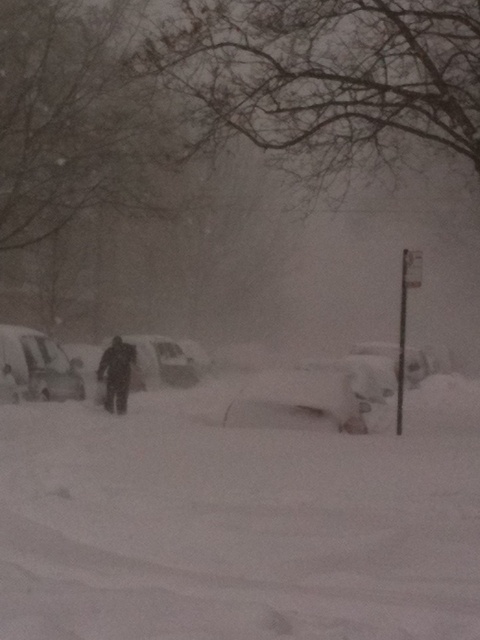
Question: Which object is the farthest from the white matte car at center?

Choices:
 (A) snow-covered sedan at left
 (B) dark gray fabric skier at center

Answer: (B)

Question: Can you confirm if white fluffy snow at center is wider than white matte car at center?

Choices:
 (A) no
 (B) yes

Answer: (B)

Question: Is snow-covered sedan at left positioned behind white matte car at center?

Choices:
 (A) yes
 (B) no

Answer: (B)

Question: Which of the following is the farthest from the observer?

Choices:
 (A) (203, 560)
 (B) (131, 346)
 (C) (11, 392)
 (D) (181, 349)

Answer: (D)

Question: Among these objects, which one is nearest to the camera?

Choices:
 (A) white matte car at center
 (B) white fluffy snow at center
 (C) dark gray fabric skier at center
 (D) snow-covered sedan at left

Answer: (B)

Question: Does snow-covered sedan at left have a lesser width compared to white matte car at center?

Choices:
 (A) yes
 (B) no

Answer: (B)